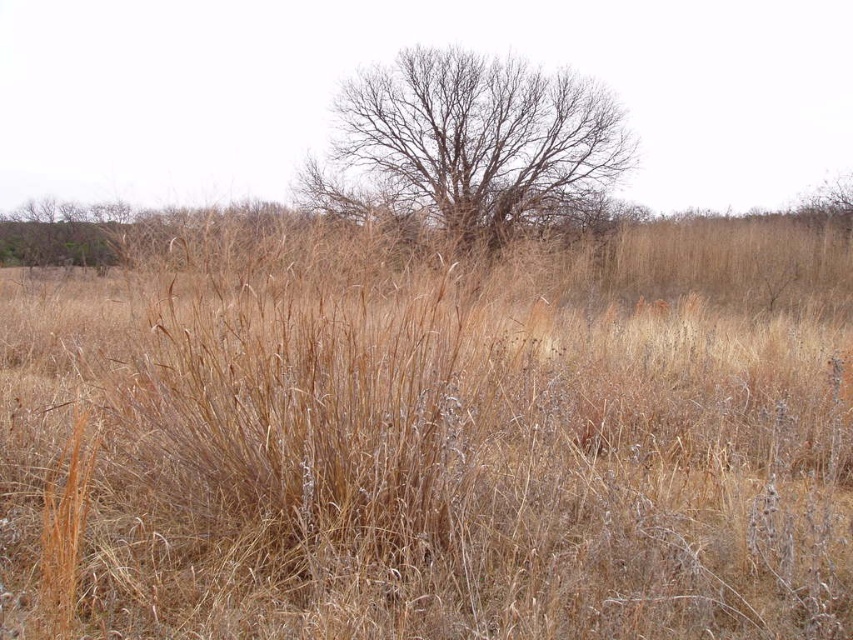
Describe the element at coordinates (431, 436) in the screenshot. I see `brown dry grass at center` at that location.

Between point (300, 524) and point (480, 193), which one is positioned in front?

Point (300, 524) is in front.

This screenshot has height=640, width=853. What are the coordinates of `brown dry grass at center` in the screenshot? It's located at (431, 436).